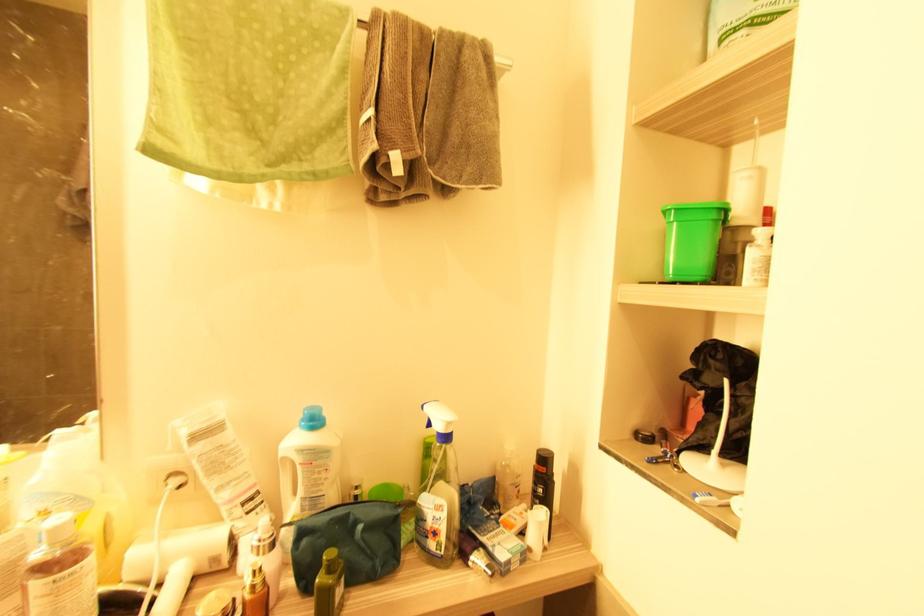
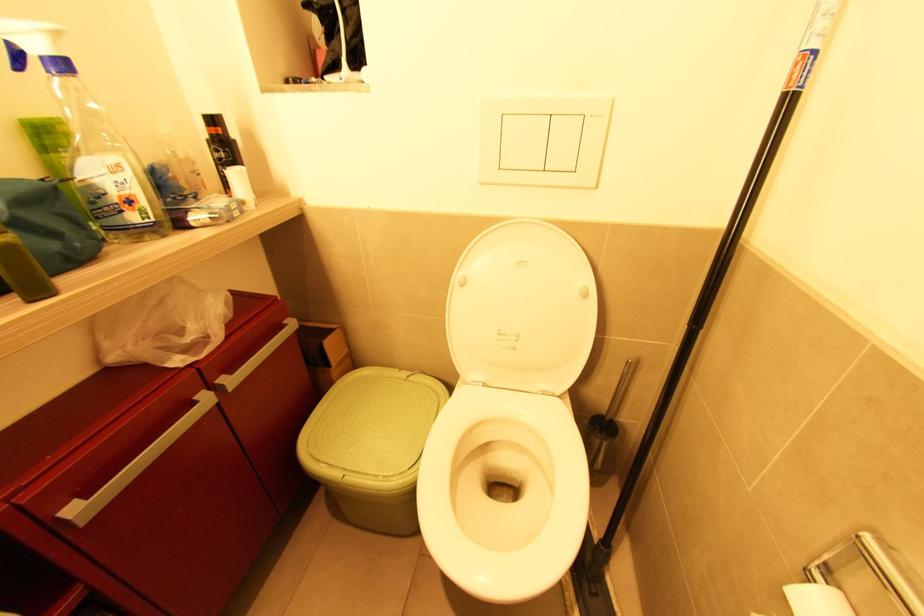
Based on the continuous images, in which direction is the camera rotating?

The rotation direction of the camera is right-down.